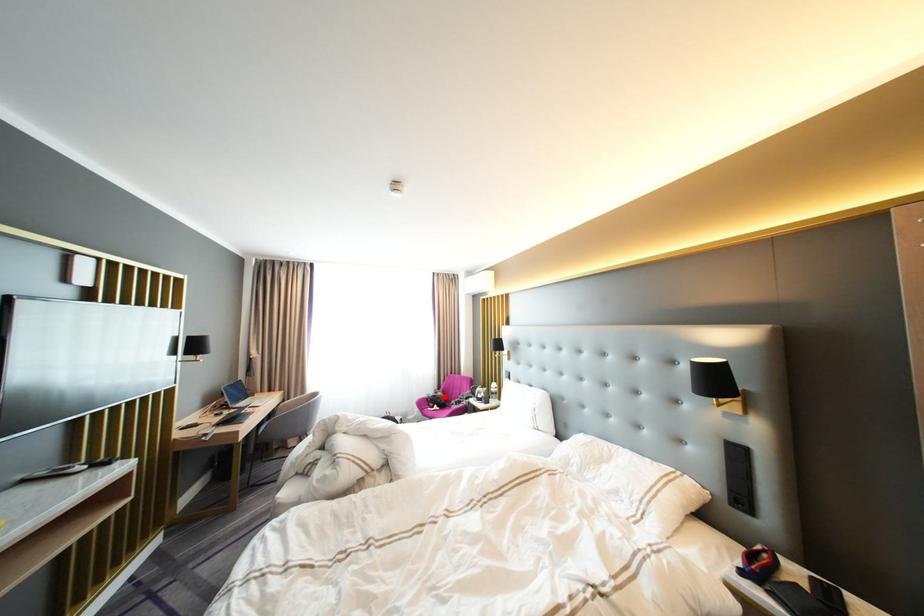
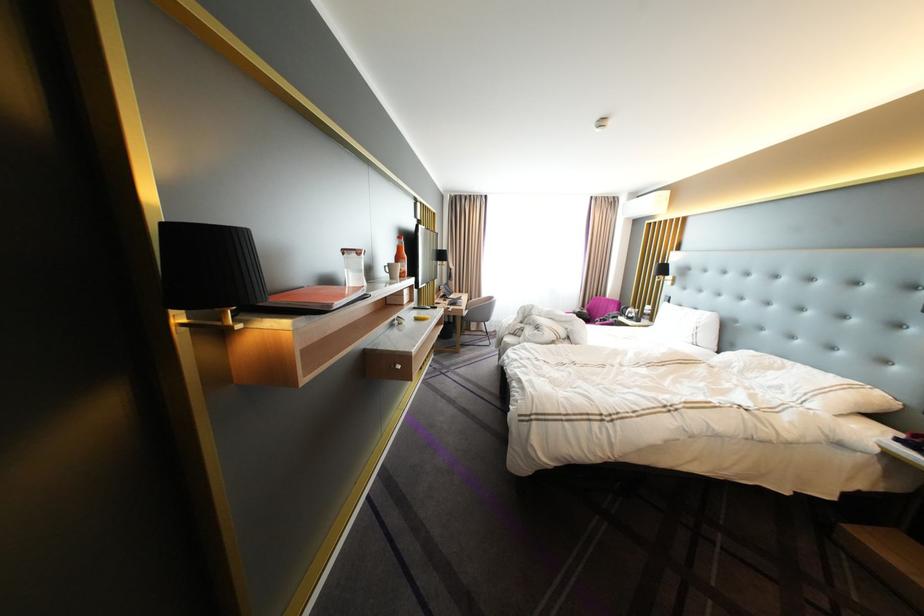
The point at the highlighted location is marked in the first image. Where is the corresponding point in the second image?

(590, 313)